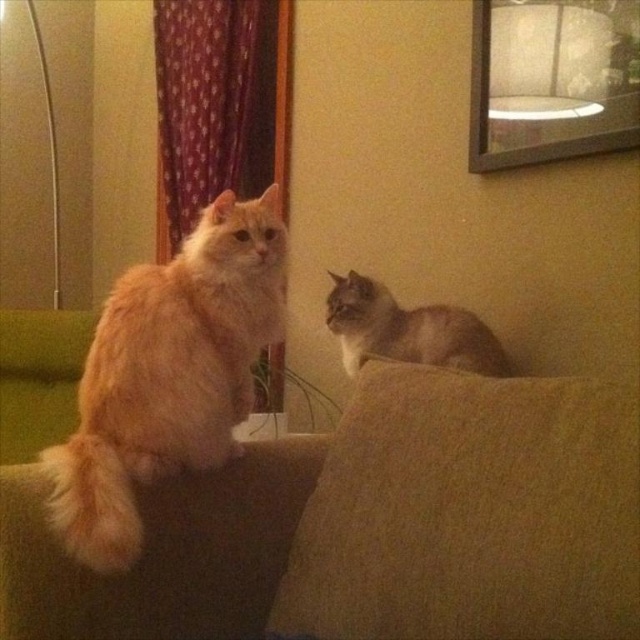
Between brown fabric couch at center and silvery-gray fur cat at upper right, which one has more height?

Standing taller between the two is brown fabric couch at center.

Between brown fabric couch at center and silvery-gray fur cat at upper right, which one is positioned lower?

brown fabric couch at center is below.

You are a GUI agent. You are given a task and a screenshot of the screen. Output one action in this format:
    pyautogui.click(x=<x>, y=<y>)
    Task: Click on the brown fabric couch at center
    Image resolution: width=640 pixels, height=640 pixels.
    Given the screenshot: What is the action you would take?
    pyautogui.click(x=371, y=525)

Who is taller, brown fabric couch at center or fluffy orange cat at left?

With more height is fluffy orange cat at left.

Who is positioned more to the left, brown fabric couch at center or fluffy orange cat at left?

fluffy orange cat at left

Locate an element on the screen. This screenshot has height=640, width=640. brown fabric couch at center is located at coordinates (371, 525).

This screenshot has width=640, height=640. In order to click on brown fabric couch at center in this screenshot , I will do `click(371, 525)`.

Which is above, fluffy orange cat at left or silvery-gray fur cat at upper right?

silvery-gray fur cat at upper right is above.

Which is more to the right, fluffy orange cat at left or silvery-gray fur cat at upper right?

From the viewer's perspective, silvery-gray fur cat at upper right appears more on the right side.

Between point (204, 346) and point (394, 324), which one is positioned behind?

The point (394, 324) is behind.

You are a GUI agent. You are given a task and a screenshot of the screen. Output one action in this format:
    pyautogui.click(x=<x>, y=<y>)
    Task: Click on the fluffy orange cat at left
    The image size is (640, 640).
    Given the screenshot: What is the action you would take?
    click(168, 374)